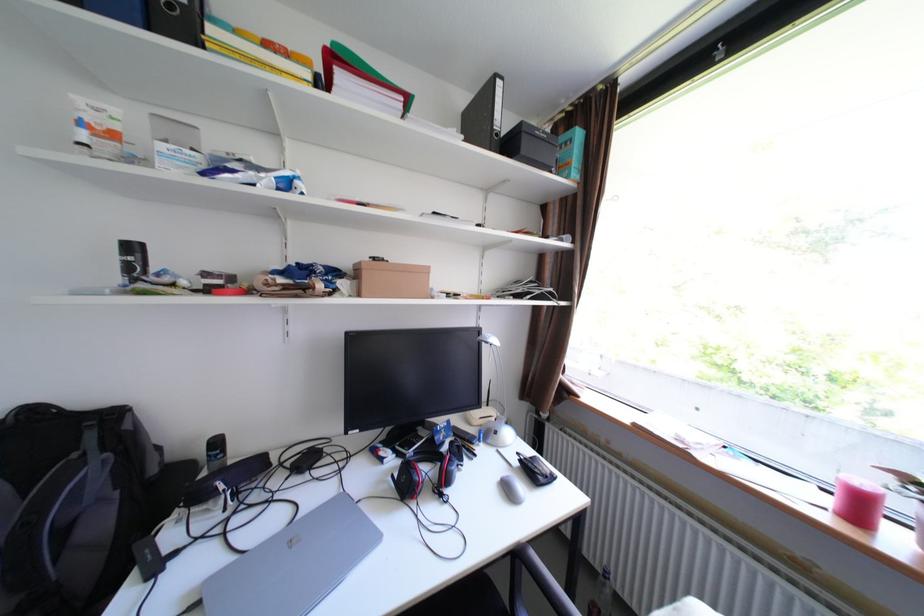
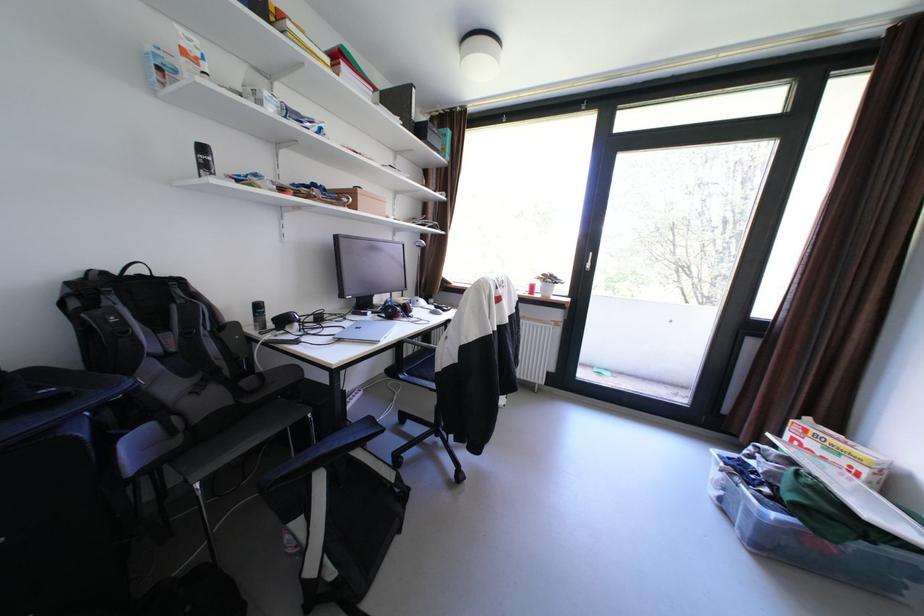
Question: I am providing you with two images of the same scene from different viewpoints. Please identify which objects are invisible in image2.

Choices:
 (A) small cardboard box
 (B) plastic storage bin
 (C) acrylic brochure holder
 (D) silver computer mouse

Answer: (D)